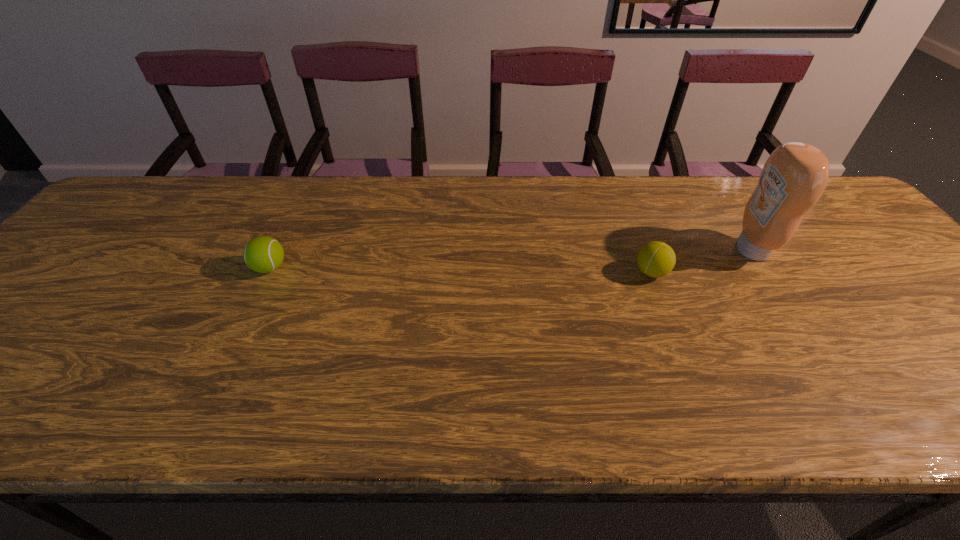
Where is `free space between the leftmost object and the rightmost object`? This screenshot has width=960, height=540. free space between the leftmost object and the rightmost object is located at coordinates (511, 259).

Locate an element on the screen. This screenshot has height=540, width=960. free space between the tallest object and the right tennis ball is located at coordinates (702, 261).

You are a GUI agent. You are given a task and a screenshot of the screen. Output one action in this format:
    pyautogui.click(x=<x>, y=<y>)
    Task: Click on the free space between the tallest object and the second object from right to left
    The image size is (960, 540).
    Given the screenshot: What is the action you would take?
    pyautogui.click(x=702, y=261)

At what (x,y) coordinates should I click in order to perform the action: click on object that stands as the second closest to the left tennis ball. Please return your answer as a coordinate pair (x, y). The height and width of the screenshot is (540, 960). Looking at the image, I should click on (795, 175).

I want to click on the closest object to the second object from left to right, so click(795, 175).

Identify the location of vacant position in the image that satisfies the following two spatial constraints: 1. on the label of the rightmost object; 2. on the front side of the second object from left to right. (766, 272).

Locate an element on the screen. Image resolution: width=960 pixels, height=540 pixels. vacant position in the image that satisfies the following two spatial constraints: 1. on the label of the tallest object; 2. on the front side of the left tennis ball is located at coordinates (763, 268).